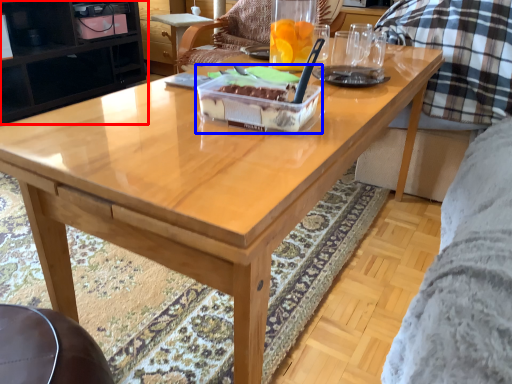
Question: Which point is further to the camera, cabinetry (highlighted by a red box) or cake (highlighted by a blue box)?

Choices:
 (A) cabinetry
 (B) cake

Answer: (A)